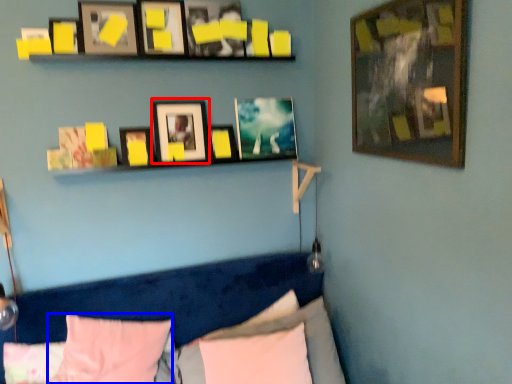
Question: Which of the following is the farthest to the observer, picture frame (highlighted by a red box) or pillow (highlighted by a blue box)?

Choices:
 (A) picture frame
 (B) pillow

Answer: (A)